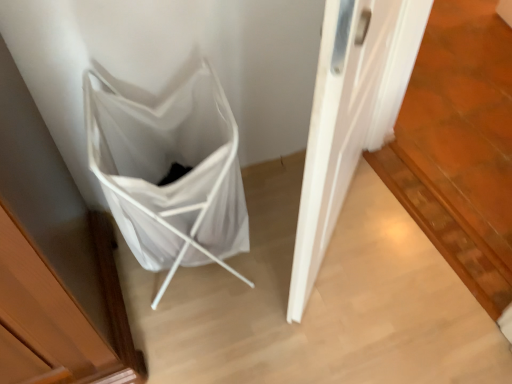
You are a GUI agent. You are given a task and a screenshot of the screen. Output one action in this format:
    pyautogui.click(x=<x>, y=<y>)
    Task: Click on the vacant space to the right of white fabric folding chair at lower left
    The width and height of the screenshot is (512, 384).
    Given the screenshot: What is the action you would take?
    click(290, 262)